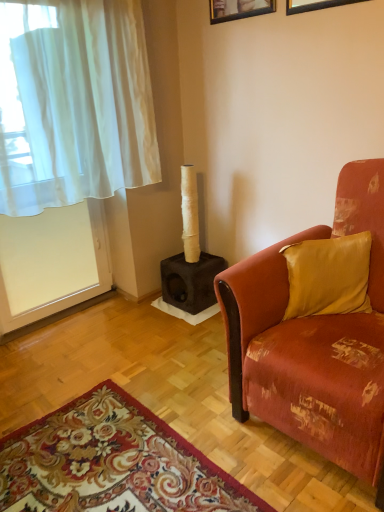
You are a GUI agent. You are given a task and a screenshot of the screen. Output one action in this format:
    pyautogui.click(x=<x>, y=<y>)
    Task: Click on the vacant space situated above floral carpet at lower left (from a real-world perspective)
    
    Given the screenshot: What is the action you would take?
    pyautogui.click(x=95, y=459)